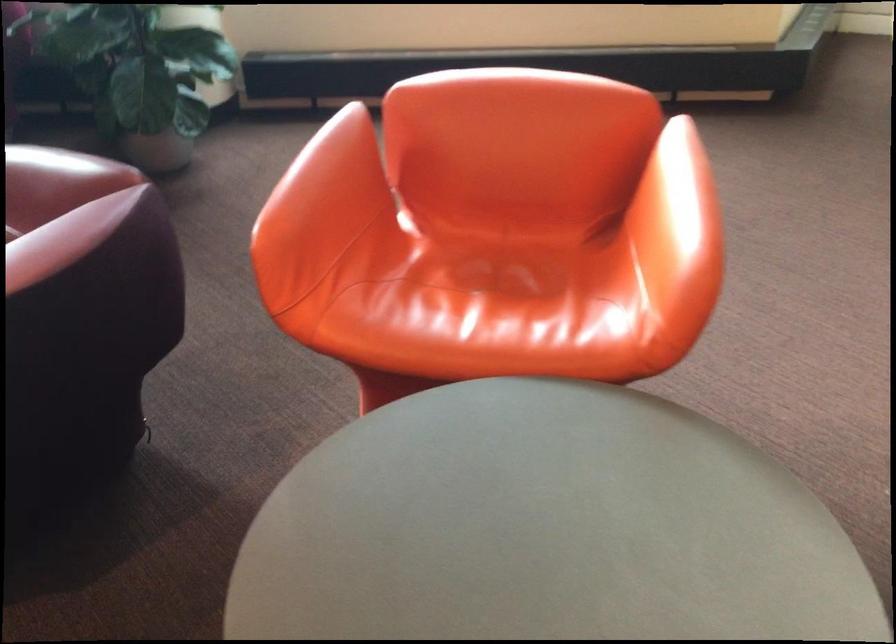
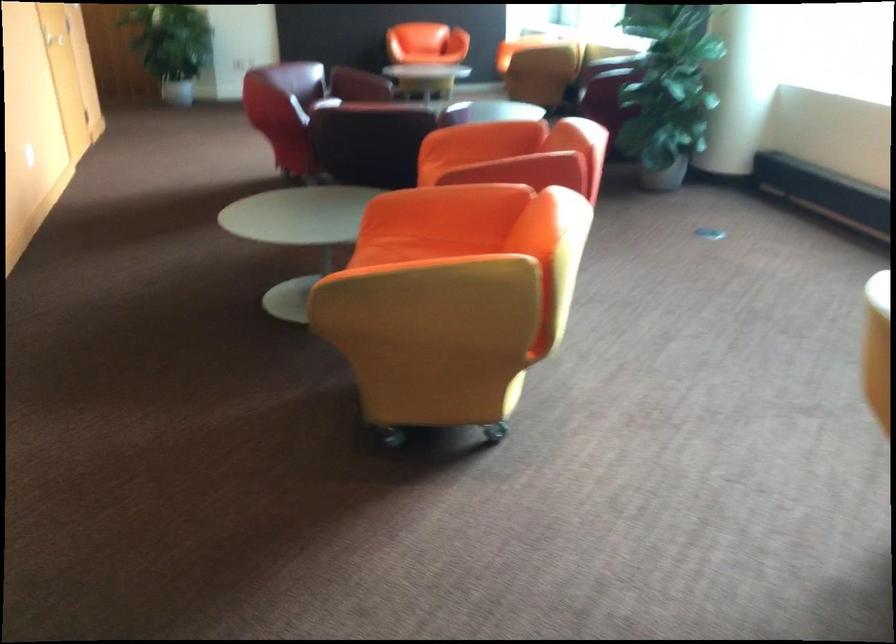
Where in the second image is the point corresponding to [687,199] from the first image?

(492, 151)